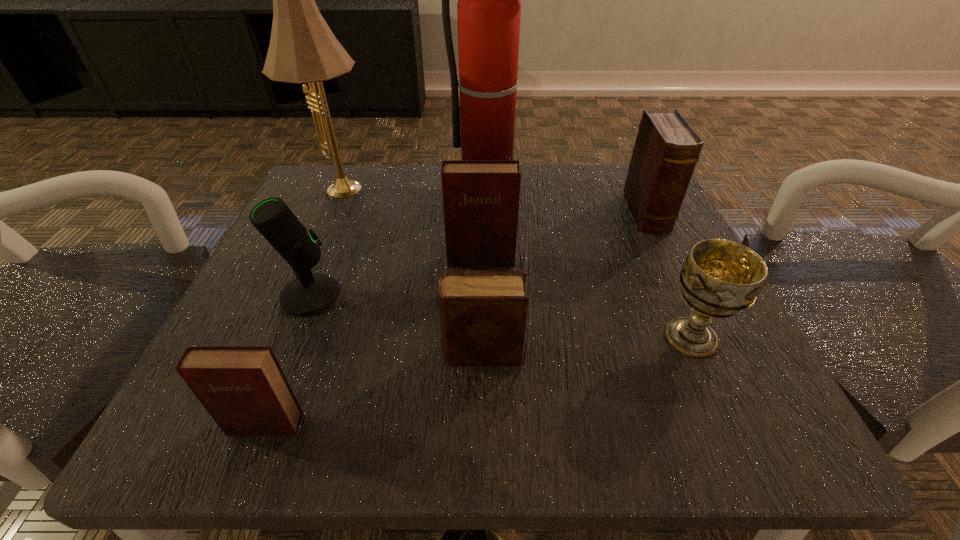
Locate an element on the screen. The height and width of the screenshot is (540, 960). vacant area that lies between the microphone and the smaller brown diary is located at coordinates (396, 324).

Where is `free area in between the lampshade and the white chalice`? free area in between the lampshade and the white chalice is located at coordinates (516, 265).

Where is `empty location between the fire extinguisher and the microphone`? empty location between the fire extinguisher and the microphone is located at coordinates (400, 242).

At what (x,y) coordinates should I click in order to perform the action: click on unoccupied area between the chalice and the red fire extinguisher. Please return your answer as a coordinate pair (x, y). Looking at the image, I should click on (590, 263).

This screenshot has height=540, width=960. Find the location of `vacant area that lies between the rightmost diary and the nearer brown diary`. vacant area that lies between the rightmost diary and the nearer brown diary is located at coordinates (564, 284).

Where is `free space between the chalice and the third nearest diary`? Image resolution: width=960 pixels, height=540 pixels. free space between the chalice and the third nearest diary is located at coordinates (586, 299).

In order to click on vacant area that lies between the nearest diary and the red fire extinguisher in this screenshot , I will do `click(377, 307)`.

What are the coordinates of `free area in between the microphone and the third farthest diary` in the screenshot? It's located at (396, 324).

The width and height of the screenshot is (960, 540). I want to click on object that is the third nearest to the farthest diary, so click(480, 197).

Select which object appears as the fourth closest to the farthest diary. Please provide its 2D coordinates. Your answer should be formatted as a tuple, i.e. [(x, y)], where the tuple contains the x and y coordinates of a point satisfying the conditions above.

[(482, 314)]